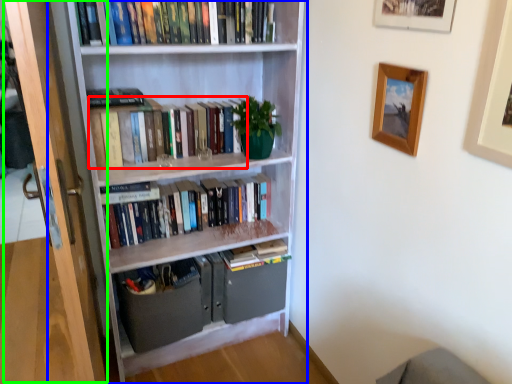
Question: Which object is the farthest from book (highlighted by a red box)? Choose among these: bookcase (highlighted by a blue box) or screen door (highlighted by a green box).

Choices:
 (A) bookcase
 (B) screen door

Answer: (B)